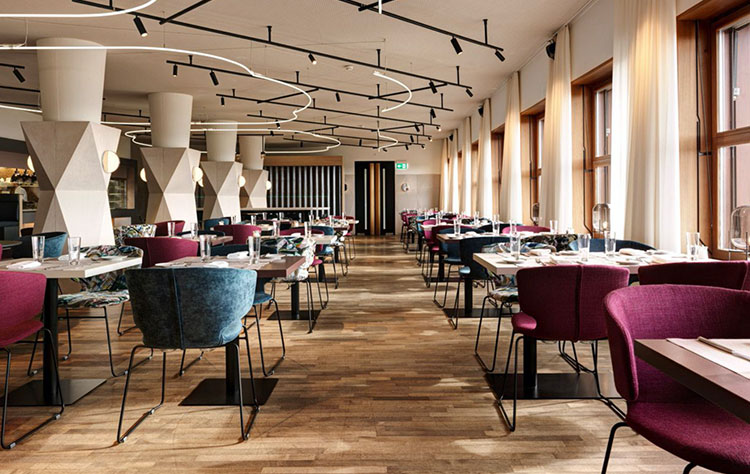
You are a GUI agent. You are given a task and a screenshot of the screen. Output one action in this format:
    pyautogui.click(x=<x>, y=<y>)
    Task: Click on the curtains
    Image resolution: width=750 pixels, height=474 pixels.
    Given the screenshot: What is the action you would take?
    pyautogui.click(x=444, y=172), pyautogui.click(x=450, y=175), pyautogui.click(x=466, y=179), pyautogui.click(x=487, y=183), pyautogui.click(x=520, y=188), pyautogui.click(x=561, y=191), pyautogui.click(x=646, y=190)